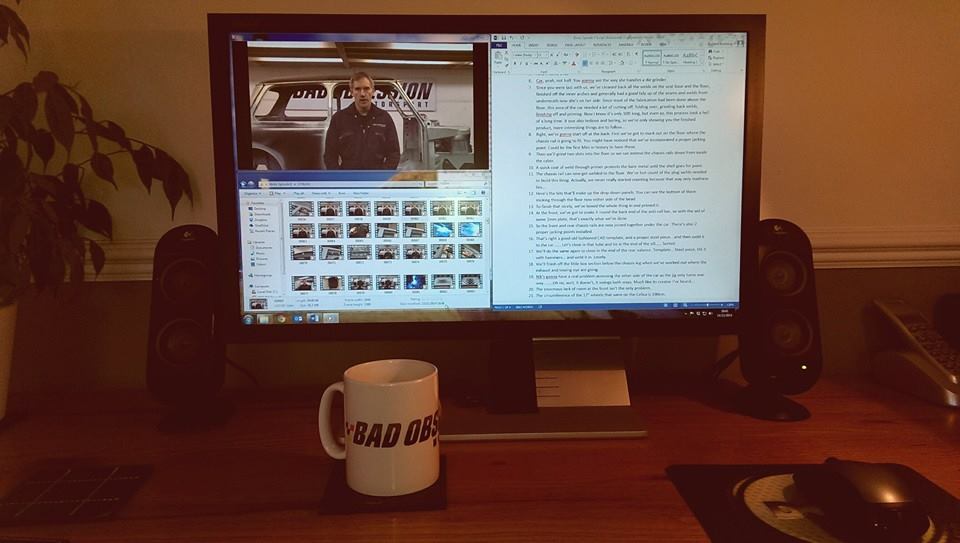
The height and width of the screenshot is (543, 960). In order to click on computer speakers in this screenshot , I will do `click(776, 308)`, `click(178, 293)`.